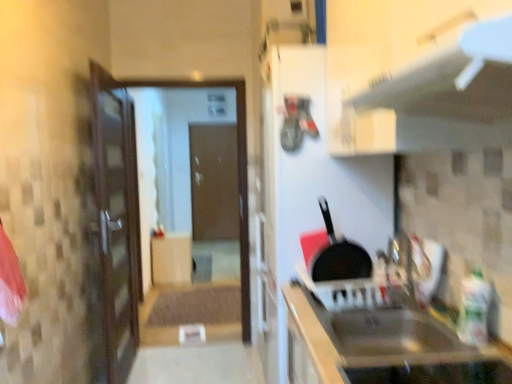
Question: Are metallic gray exhaust hood at upper center and matte wood cabinet at center, positioned as the second cabinetry in front-to-back order, making contact?

Choices:
 (A) no
 (B) yes

Answer: (A)

Question: From the image's perspective, is metallic gray exhaust hood at upper center below matte wood cabinet at center, the 1th cabinetry positioned from the back?

Choices:
 (A) no
 (B) yes

Answer: (A)

Question: Is metallic gray exhaust hood at upper center aimed at matte wood cabinet at center, marked as the 1th cabinetry in a left-to-right arrangement?

Choices:
 (A) no
 (B) yes

Answer: (A)

Question: Can matte wood cabinet at center, marked as the 1th cabinetry in a left-to-right arrangement, be found inside metallic gray exhaust hood at upper center?

Choices:
 (A) no
 (B) yes

Answer: (A)

Question: Considering the relative sizes of metallic gray exhaust hood at upper center and matte wood cabinet at center, marked as the 1th cabinetry in a left-to-right arrangement, in the image provided, is metallic gray exhaust hood at upper center smaller than matte wood cabinet at center, marked as the 1th cabinetry in a left-to-right arrangement,?

Choices:
 (A) no
 (B) yes

Answer: (B)

Question: Is brown matte door at center inside the boundaries of metallic gray exhaust hood at upper center, or outside?

Choices:
 (A) inside
 (B) outside

Answer: (B)

Question: Is point (216, 127) positioned closer to the camera than point (347, 144)?

Choices:
 (A) farther
 (B) closer

Answer: (A)

Question: Considering the positions of brown matte door at center and metallic gray exhaust hood at upper center in the image, is brown matte door at center taller or shorter than metallic gray exhaust hood at upper center?

Choices:
 (A) tall
 (B) short

Answer: (A)

Question: Looking at their shapes, would you say brown matte door at center is wider or thinner than metallic gray exhaust hood at upper center?

Choices:
 (A) thin
 (B) wide

Answer: (A)

Question: From a real-world perspective, relative to metallic gray exhaust hood at upper center, is metallic stainless steel sink at lower right, which is counted as the 1th cabinetry, starting from the front, vertically above or below?

Choices:
 (A) above
 (B) below

Answer: (B)

Question: Does point (376, 332) appear closer or farther from the camera than point (502, 92)?

Choices:
 (A) closer
 (B) farther

Answer: (B)

Question: Would you say metallic stainless steel sink at lower right, which ranks as the second cabinetry in back-to-front order, is to the left or to the right of metallic gray exhaust hood at upper center in the picture?

Choices:
 (A) left
 (B) right

Answer: (A)

Question: From the image's perspective, relative to metallic gray exhaust hood at upper center, is metallic stainless steel sink at lower right, which appears as the first cabinetry when viewed from the right, above or below?

Choices:
 (A) below
 (B) above

Answer: (A)

Question: Would you say transparent glass door at center is to the left or to the right of black matte frying pan at center in the picture?

Choices:
 (A) left
 (B) right

Answer: (A)

Question: Considering the positions of point (122, 84) and point (358, 278), is point (122, 84) closer or farther from the camera than point (358, 278)?

Choices:
 (A) closer
 (B) farther

Answer: (B)